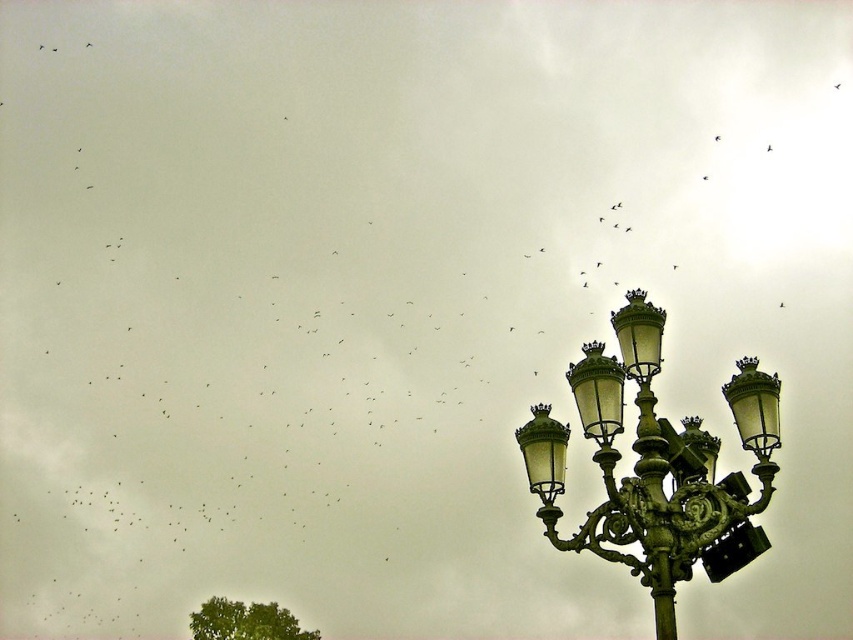
Can you confirm if green patinated metal street light at right is bigger than green leafy tree at lower left?

Yes.

Can you confirm if green patinated metal street light at right is smaller than green leafy tree at lower left?

No, green patinated metal street light at right is not smaller than green leafy tree at lower left.

Find the location of a particular element. green patinated metal street light at right is located at coordinates (657, 465).